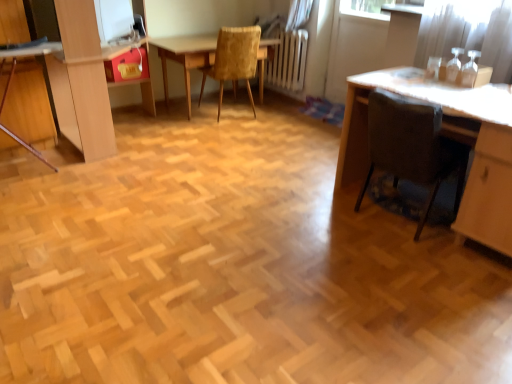
Question: From their relative heights in the image, would you say wooden table at center is taller or shorter than matte wooden dresser at left?

Choices:
 (A) short
 (B) tall

Answer: (A)

Question: Does point click(262, 46) appear closer or farther from the camera than point click(81, 145)?

Choices:
 (A) farther
 (B) closer

Answer: (A)

Question: Based on their relative distances, which object is nearer to the brown fabric chair at lower right, the second chair viewed from the left?

Choices:
 (A) matte red drawer at upper left
 (B) wooden table at center
 (C) transparent glass screen door at upper right
 (D) matte wooden dresser at left
 (E) velvet yellow chair at center, which appears as the first chair when viewed from the left

Answer: (C)

Question: Considering the real-world distances, which object is farthest from the velvet yellow chair at center, which is the second chair in front-to-back order?

Choices:
 (A) wooden table at center
 (B) matte wooden dresser at left
 (C) matte red drawer at upper left
 (D) brown fabric chair at lower right, which is the 2th chair from back to front
 (E) transparent glass screen door at upper right

Answer: (D)